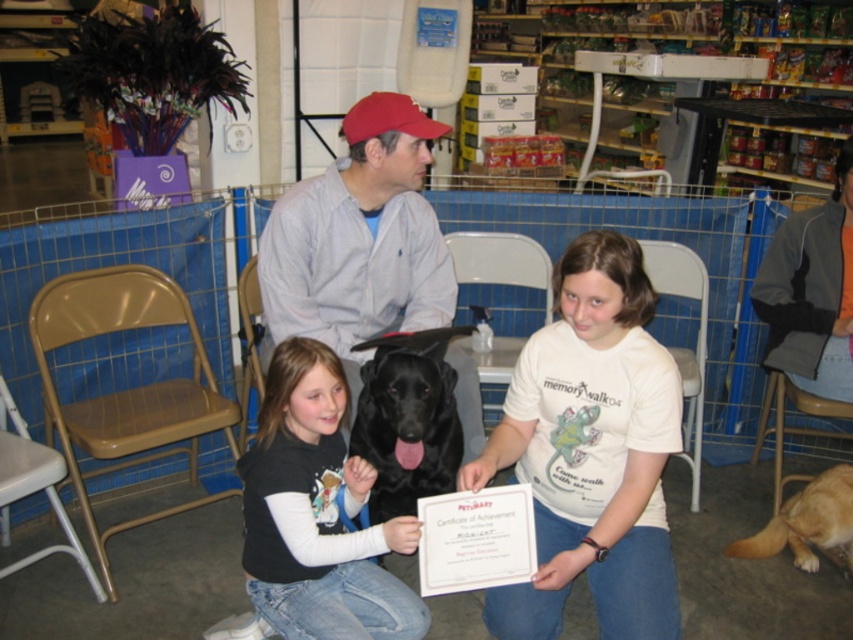
Which is behind, point (312, 326) or point (437, 412)?

The point (312, 326) is more distant.

Can you confirm if gray fleece jacket at center is shorter than black matte dog at center?

Incorrect, gray fleece jacket at center's height does not fall short of black matte dog at center's.

Who is more forward, (422, 260) or (399, 392)?

Point (399, 392) is more forward.

Image resolution: width=853 pixels, height=640 pixels. I want to click on gray fleece jacket at center, so click(x=358, y=240).

Is black matte shirt at center bigger than orange fleece jacket at upper right?

Yes.

Between black matte shirt at center and orange fleece jacket at upper right, which one is positioned higher?

orange fleece jacket at upper right is higher up.

Is point (271, 545) positioned before point (807, 228)?

Yes, it is.

At what (x,y) coordinates should I click in order to perform the action: click on black matte shirt at center. Please return your answer as a coordinate pair (x, y). The image size is (853, 640). Looking at the image, I should click on (317, 513).

Between point (544, 464) and point (268, 577), which one is positioned in front?

Point (268, 577) is in front.

Locate an element on the screen. white cotton shirt at center is located at coordinates (590, 451).